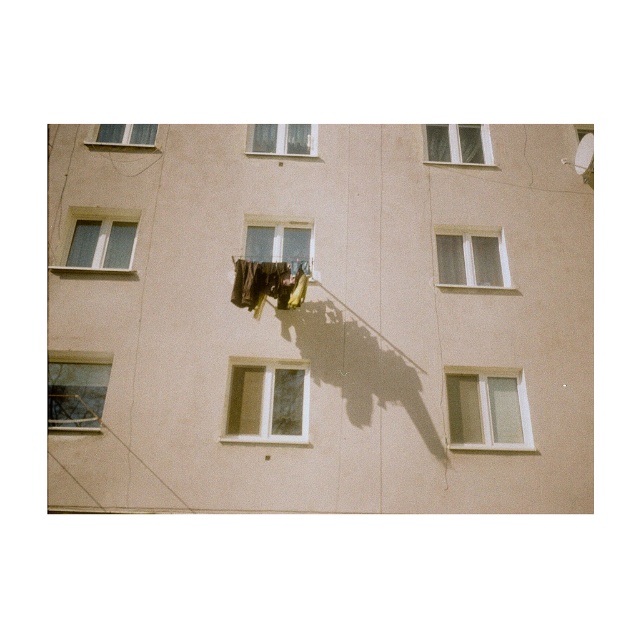
You are standing in front of the residential building and see the yellow fabric at center. Can you estimate its exact 2D coordinates on the wall?

The yellow fabric at center is located at the 2D coordinates of point [268,284] on the wall.

You are a window installer assessing the building facade. You need to replace the clear glass window at upper left and the white plastic window at upper center. Which window should you replace first if you start from the ground floor and move upward?

You should replace the white plastic window at upper center first because the clear glass window at upper left is positioned under it, meaning the white plastic window at upper center is higher up and closer to the ground when ascending from the ground floor.